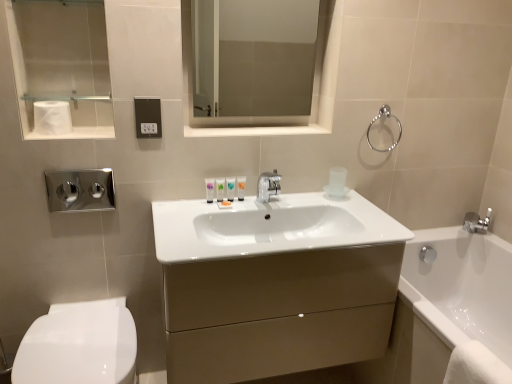
At what (x,y) coordinates should I click in order to perform the action: click on free spot in front of white glossy tube at center, which is the 4th toiletry in left-to-right order. Please return your answer as a coordinate pair (x, y). The width and height of the screenshot is (512, 384). Looking at the image, I should click on (222, 211).